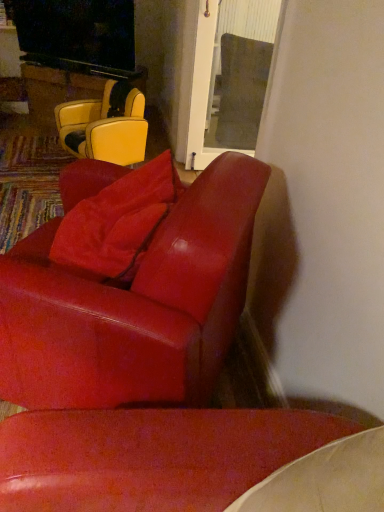
Question: Can you confirm if wooden glossy table at upper left is thinner than matte red leather chair at center, positioned as the 1th chair in front-to-back order?

Choices:
 (A) no
 (B) yes

Answer: (B)

Question: Is wooden glossy table at upper left placed right next to matte red leather chair at center, marked as the second chair in a back-to-front arrangement?

Choices:
 (A) yes
 (B) no

Answer: (B)

Question: Can you confirm if wooden glossy table at upper left is positioned to the right of matte red leather chair at center, positioned as the 1th chair in front-to-back order?

Choices:
 (A) no
 (B) yes

Answer: (A)

Question: Does wooden glossy table at upper left have a smaller size compared to matte red leather chair at center, marked as the second chair in a back-to-front arrangement?

Choices:
 (A) no
 (B) yes

Answer: (B)

Question: Is matte red leather chair at center, marked as the second chair in a back-to-front arrangement, at the back of wooden glossy table at upper left?

Choices:
 (A) no
 (B) yes

Answer: (A)

Question: Does wooden glossy table at upper left have a greater height compared to matte red leather chair at center, positioned as the first chair in bottom-to-top order?

Choices:
 (A) yes
 (B) no

Answer: (B)

Question: From the image's perspective, is leather yellow chair at upper left, which ranks as the 2th chair in front-to-back order, under suede-like red pillow at center?

Choices:
 (A) no
 (B) yes

Answer: (A)

Question: Can you confirm if leather yellow chair at upper left, which ranks as the 2th chair in front-to-back order, is positioned to the left of suede-like red pillow at center?

Choices:
 (A) yes
 (B) no

Answer: (A)

Question: From the image's perspective, would you say leather yellow chair at upper left, acting as the 1th chair starting from the top, is positioned over suede-like red pillow at center?

Choices:
 (A) no
 (B) yes

Answer: (B)

Question: Would you say leather yellow chair at upper left, which is the first chair from back to front, is outside suede-like red pillow at center?

Choices:
 (A) yes
 (B) no

Answer: (A)

Question: Is leather yellow chair at upper left, which ranks as the 2th chair in front-to-back order, looking in the opposite direction of suede-like red pillow at center?

Choices:
 (A) no
 (B) yes

Answer: (A)

Question: Considering the relative positions of leather yellow chair at upper left, which ranks as the 2th chair in front-to-back order, and suede-like red pillow at center in the image provided, is leather yellow chair at upper left, which ranks as the 2th chair in front-to-back order, behind suede-like red pillow at center?

Choices:
 (A) yes
 (B) no

Answer: (A)

Question: Is suede-like red pillow at center positioned behind leather yellow chair at upper left, placed as the 2th chair when sorted from bottom to top?

Choices:
 (A) no
 (B) yes

Answer: (A)